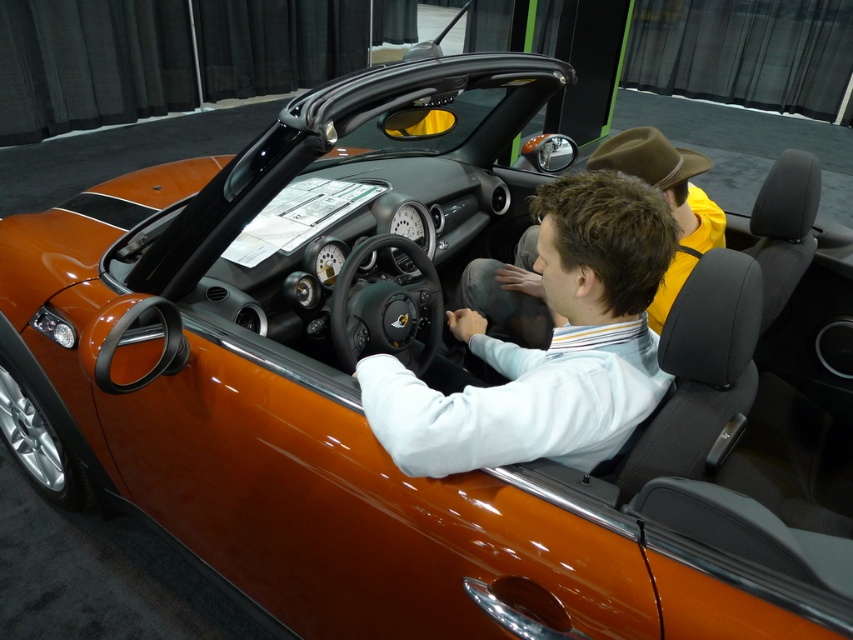
Question: Is matte white shirt at center closer to the viewer compared to matte brown hat at center?

Choices:
 (A) no
 (B) yes

Answer: (B)

Question: Can you confirm if matte white shirt at center is positioned to the left of matte brown hat at center?

Choices:
 (A) no
 (B) yes

Answer: (B)

Question: Which object appears closest to the camera in this image?

Choices:
 (A) matte white shirt at center
 (B) matte brown hat at center

Answer: (A)

Question: Is matte white shirt at center positioned before matte brown hat at center?

Choices:
 (A) no
 (B) yes

Answer: (B)